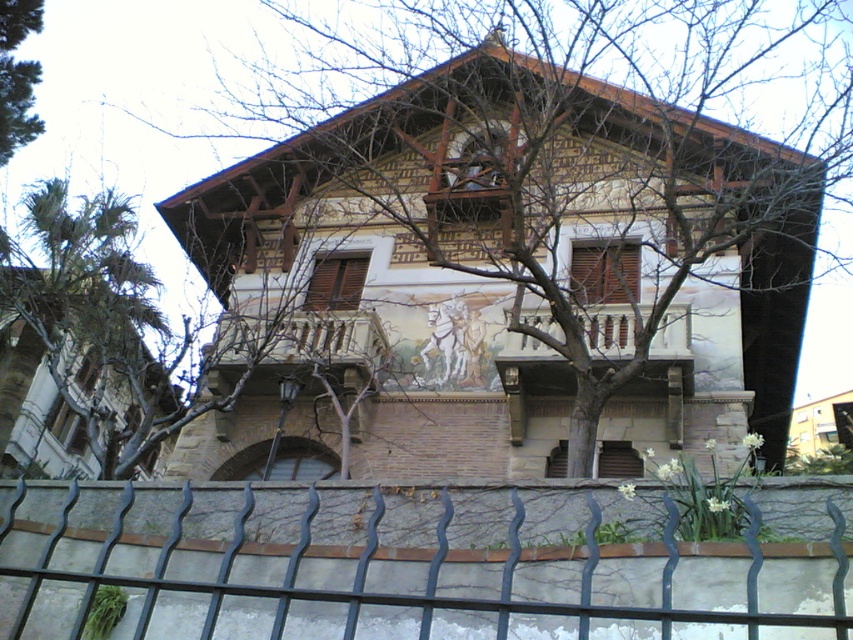
You are standing in front of the building and want to touch the wooden railing at center. Based on the coordinates provided, is the railing located closer to the top or bottom half of the image?

The wooden railing at center is located at coordinates point (299, 339), which places it in the bottom half of the image.

You are standing in front of the two story building with a traditional architectural style. You see a point at coordinate (416, 563). What object is located at that point?

The point at coordinate (416, 563) corresponds to the black wrought iron fence at lower center.